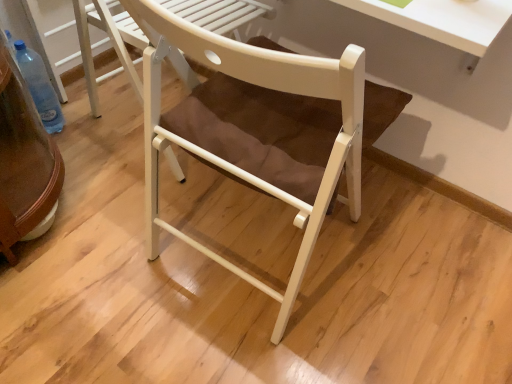
This screenshot has width=512, height=384. I want to click on free space between transparent plastic bottle at lower left and white matte chair at center, positioned as the 1th chair in back-to-front order, so click(x=101, y=135).